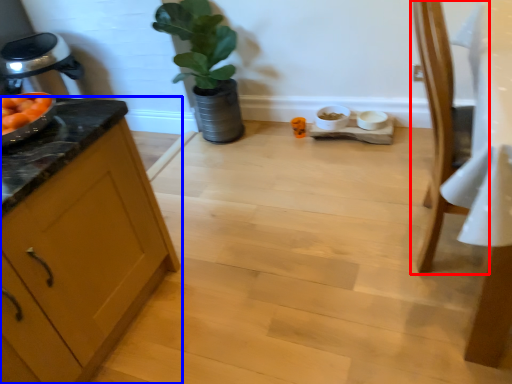
Question: Among these objects, which one is farthest to the camera, chair (highlighted by a red box) or cabinetry (highlighted by a blue box)?

Choices:
 (A) chair
 (B) cabinetry

Answer: (A)